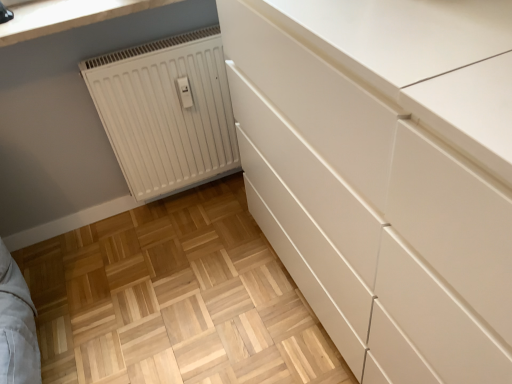
This screenshot has width=512, height=384. Identify the location of white matte radiator at lower left. (166, 112).

Describe the element at coordinates (166, 112) in the screenshot. The width and height of the screenshot is (512, 384). I see `white matte radiator at lower left` at that location.

In order to face white smooth countertop at upper left, should I rotate leftwards or rightwards?

You should look left and rotate roughly 21.151 degrees.

What do you see at coordinates (66, 16) in the screenshot? This screenshot has width=512, height=384. I see `white smooth countertop at upper left` at bounding box center [66, 16].

Find the location of a particular element. The width and height of the screenshot is (512, 384). white smooth countertop at upper left is located at coordinates click(x=66, y=16).

Locate an element on the screen. white matte radiator at lower left is located at coordinates (166, 112).

Visually, is white matte radiator at lower left positioned to the left or to the right of white smooth countertop at upper left?

Clearly, white matte radiator at lower left is on the right of white smooth countertop at upper left in the image.

Who is more distant, white matte radiator at lower left or white smooth countertop at upper left?

white matte radiator at lower left.

Is point (137, 79) positioned behind point (35, 12)?

Yes, point (137, 79) is farther from viewer.

From the image's perspective, which is below, white matte radiator at lower left or white smooth countertop at upper left?

white matte radiator at lower left, from the image's perspective.

From a real-world perspective, relative to white smooth countertop at upper left, is white matte radiator at lower left vertically above or below?

white matte radiator at lower left is situated lower than white smooth countertop at upper left in the real world.

Looking at their sizes, would you say white matte radiator at lower left is wider or thinner than white smooth countertop at upper left?

Clearly, white matte radiator at lower left has less width compared to white smooth countertop at upper left.

Can you confirm if white matte radiator at lower left is shorter than white smooth countertop at upper left?

In fact, white matte radiator at lower left may be taller than white smooth countertop at upper left.

Can you confirm if white matte radiator at lower left is smaller than white smooth countertop at upper left?

No.

Consider the image. Is white smooth countertop at upper left completely or partially inside white matte radiator at lower left?

No, white matte radiator at lower left does not contain white smooth countertop at upper left.

Are white matte radiator at lower left and white smooth countertop at upper left making contact?

No.

Is white matte radiator at lower left looking in the opposite direction of white smooth countertop at upper left?

No, white matte radiator at lower left is not facing away from white smooth countertop at upper left.

How different are the orientations of white matte radiator at lower left and white smooth countertop at upper left in degrees?

0.885 degrees separate the facing orientations of white matte radiator at lower left and white smooth countertop at upper left.

Locate an element on the screen. The image size is (512, 384). radiator to the right of white smooth countertop at upper left is located at coordinates (166, 112).

Looking at this image, is white smooth countertop at upper left to the right of white matte radiator at lower left from the viewer's perspective?

No.

Considering the positions of objects white smooth countertop at upper left and white matte radiator at lower left in the image provided, who is in front, white smooth countertop at upper left or white matte radiator at lower left?

white smooth countertop at upper left.

Is point (78, 7) closer to viewer compared to point (97, 69)?

Yes.

From the image's perspective, does white smooth countertop at upper left appear lower than white matte radiator at lower left?

No, from the image's perspective, white smooth countertop at upper left is not beneath white matte radiator at lower left.

From a real-world perspective, is white smooth countertop at upper left positioned over white matte radiator at lower left based on gravity?

Indeed, from a real-world perspective, white smooth countertop at upper left stands above white matte radiator at lower left.

Is white smooth countertop at upper left thinner than white matte radiator at lower left?

No.

Does white smooth countertop at upper left have a greater height compared to white matte radiator at lower left?

No.

Is white smooth countertop at upper left bigger or smaller than white matte radiator at lower left?

Clearly, white smooth countertop at upper left is smaller in size than white matte radiator at lower left.

Do you think white smooth countertop at upper left is within white matte radiator at lower left, or outside of it?

white smooth countertop at upper left is not inside white matte radiator at lower left, it's outside.

Is white smooth countertop at upper left beside white matte radiator at lower left?

No.

Could you tell me if white smooth countertop at upper left is turned towards white matte radiator at lower left?

No, white smooth countertop at upper left is not turned towards white matte radiator at lower left.

How different are the orientations of white smooth countertop at upper left and white matte radiator at lower left in degrees?

They differ by 0.885 degrees in their facing directions.

Where is `countertop on the left of white matte radiator at lower left`? Image resolution: width=512 pixels, height=384 pixels. countertop on the left of white matte radiator at lower left is located at coordinates (66, 16).

Where is `countertop in front of the white matte radiator at lower left`? This screenshot has height=384, width=512. countertop in front of the white matte radiator at lower left is located at coordinates (66, 16).

Locate an element on the screen. radiator that appears below the white smooth countertop at upper left (from a real-world perspective) is located at coordinates (166, 112).